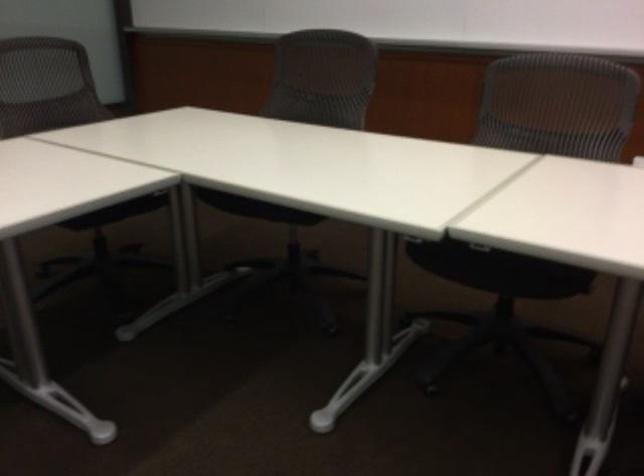
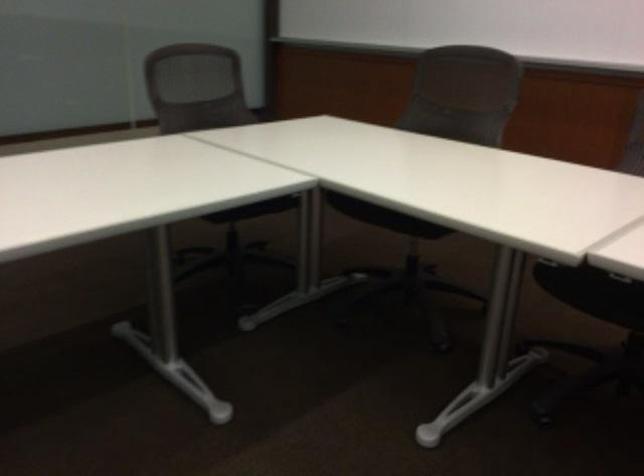
Locate, in the second image, the point that corresponds to (460,260) in the first image.

(592, 292)